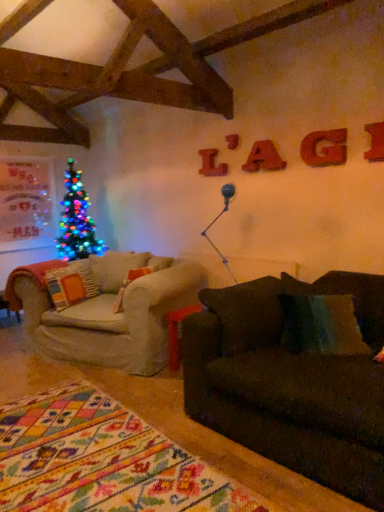
Question: Is point (327, 159) closer or farther from the camera than point (69, 270)?

Choices:
 (A) closer
 (B) farther

Answer: (A)

Question: From a real-world perspective, is matte orange letter g at upper right, arranged as the 2th letter when viewed from the front, physically located above or below orange fabric pillow at left?

Choices:
 (A) above
 (B) below

Answer: (A)

Question: Which object is the closest to the matte red letter at upper center, the 3th letter in the front-to-back sequence?

Choices:
 (A) red wood letter at upper center, which is the 1th letter in left-to-right order
 (B) metallic red letter at upper right, positioned as the first letter in right-to-left order
 (C) orange fabric pillow at left
 (D) matte orange letter g at upper right, arranged as the 2th letter when viewed from the front

Answer: (D)

Question: Which of these objects is positioned closest to the matte red letter at upper center, the 3th letter in the right-to-left sequence?

Choices:
 (A) matte orange letter g at upper right, arranged as the 2th letter when viewed from the front
 (B) orange fabric pillow at left
 (C) red wood letter at upper center, the first letter when ordered from back to front
 (D) metallic red letter at upper right, marked as the fourth letter in a back-to-front arrangement

Answer: (A)